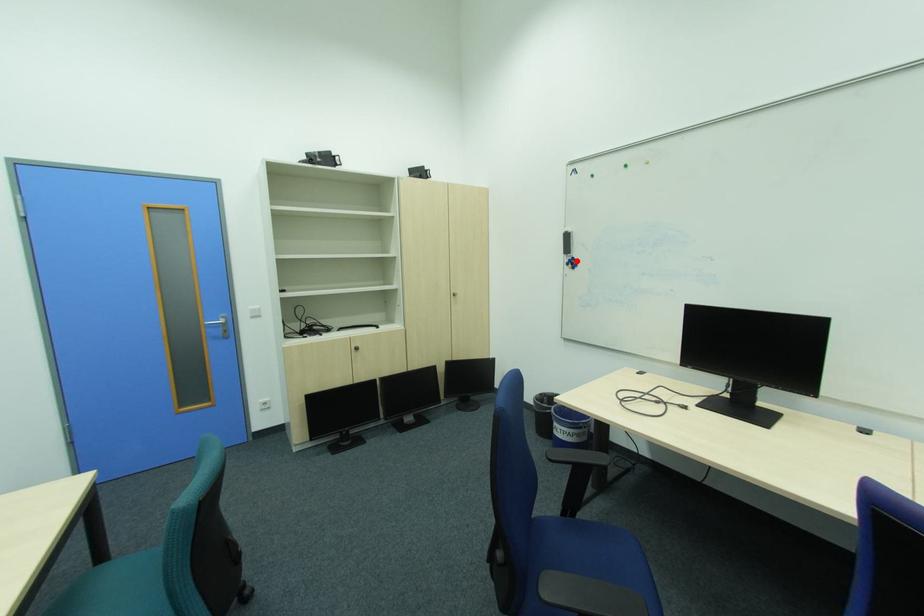
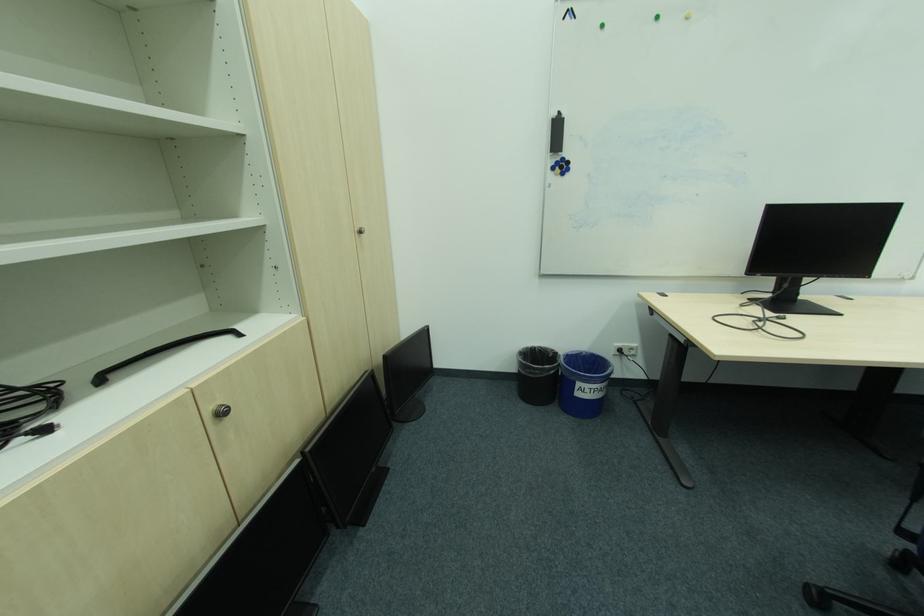
Question: I am providing you with two images of the same scene from different viewpoints. A red point is marked on the first image. Can you still see the location of the red point in image 2?

Choices:
 (A) Yes
 (B) No

Answer: (A)